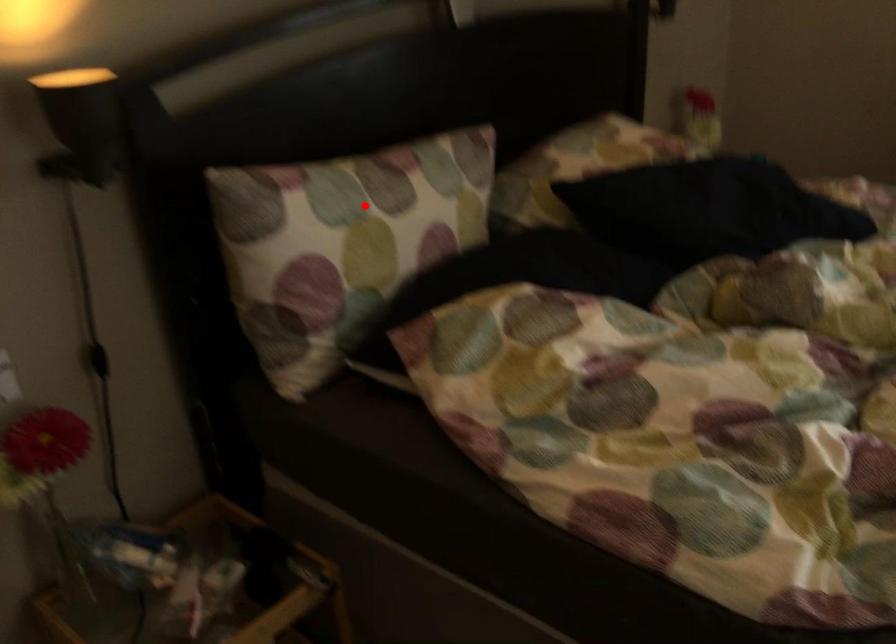
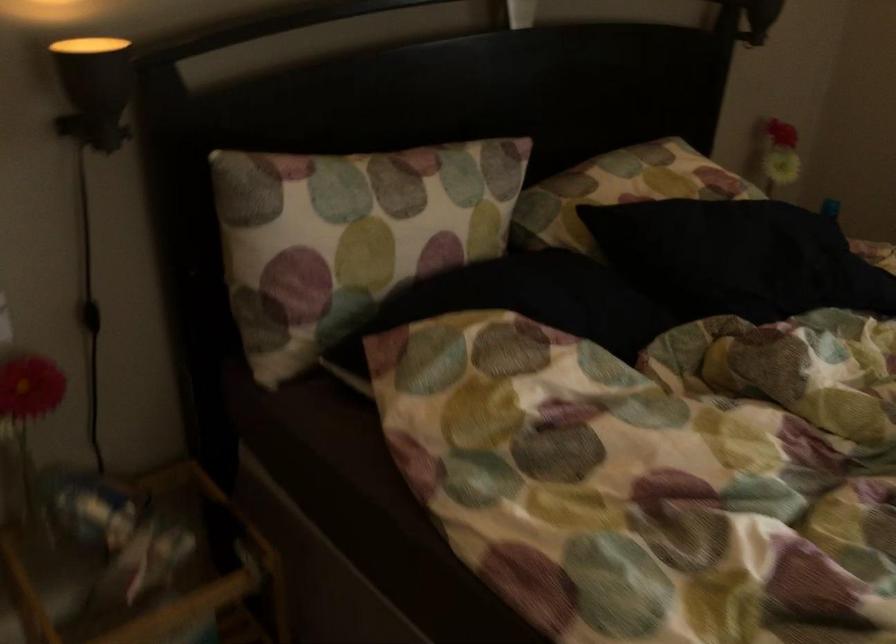
Where in the second image is the point corresponding to the highlighted location from the first image?

(367, 207)